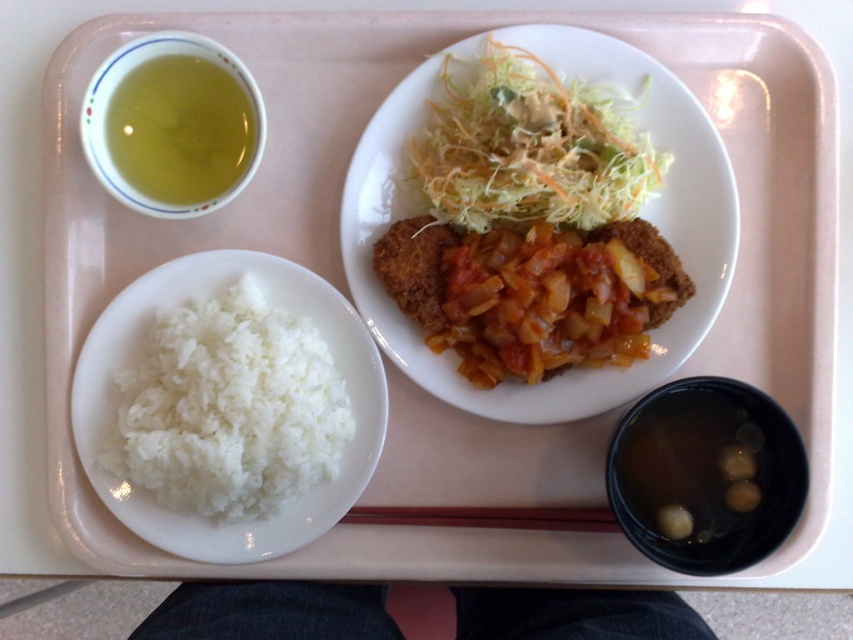
You are a food delivery person who needs to carry this tray carefully. The shredded green salad at upper center is in your line of sight. Can you see the white matte rice at lower left without moving the tray?

Yes, because the white matte rice at lower left is in front of the shredded green salad at upper center, so it is visible from your line of sight.

You are a food critic evaluating the meal on the light pink cafeteria tray. You need to describe the location of the point marked at coordinates (229, 408) relative to the main dish and the rice. Which component is the point closer to?

The point marked at coordinates (229, 408) is on the white matte rice at lower left, so it is closer to the rice than the main dish.

From the picture: You are a food critic evaluating portion sizes. You have a ruler and need to compare the width of the golden brown fried chicken at center and the shredded green salad at upper center. Which one is wider?

The golden brown fried chicken at center is wider than the shredded green salad at upper center according to the description.